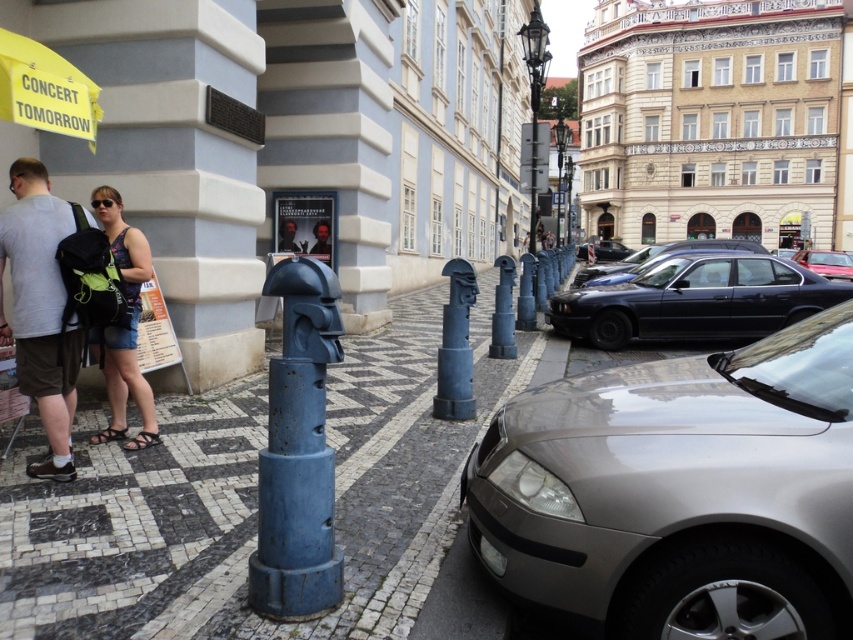
How much distance is there between matte gray backpack at left and black glossy sedan at center?

The distance of matte gray backpack at left from black glossy sedan at center is 13.72 meters.

Who is lower down, matte gray backpack at left or black glossy sedan at center?

matte gray backpack at left is below.

Which is behind, point (59, 397) or point (730, 248)?

Point (730, 248)

I want to click on matte gray backpack at left, so click(39, 308).

Is shiny black sedan at center right below metallic red car at right?

Correct, shiny black sedan at center right is located below metallic red car at right.

Does shiny black sedan at center right appear over metallic red car at right?

Incorrect, shiny black sedan at center right is not positioned above metallic red car at right.

Does point (660, 316) lie in front of point (798, 260)?

Yes, it is in front of point (798, 260).

This screenshot has height=640, width=853. What are the coordinates of `shiny black sedan at center right` in the screenshot? It's located at 695,300.

Between matte gray backpack at left and matte black tank top at center, which one is positioned lower?

matte gray backpack at left is lower down.

Does matte gray backpack at left have a lesser width compared to matte black tank top at center?

No, matte gray backpack at left is not thinner than matte black tank top at center.

Where is `matte gray backpack at left`? The image size is (853, 640). matte gray backpack at left is located at coordinates pyautogui.click(x=39, y=308).